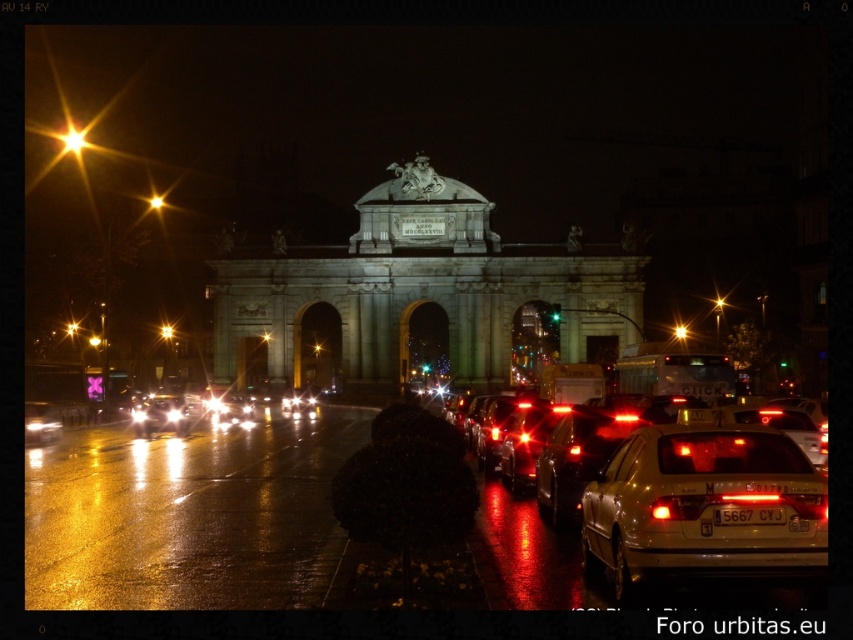
Can you confirm if metallic gold sedan at center-right is positioned below shiny silver car at lower left?

Correct, metallic gold sedan at center-right is located below shiny silver car at lower left.

Is metallic gold sedan at center-right positioned behind shiny silver car at lower left?

That is False.

Identify the location of metallic gold sedan at center-right. (717, 515).

Is metallic gold taxi at center bigger than bright metallic starburst at upper left?

Correct, metallic gold taxi at center is larger in size than bright metallic starburst at upper left.

What do you see at coordinates (704, 504) in the screenshot? Image resolution: width=853 pixels, height=640 pixels. I see `metallic gold taxi at center` at bounding box center [704, 504].

Which is in front, point (772, 445) or point (71, 129)?

Point (772, 445) is more forward.

Identify the location of metallic gold taxi at center. pyautogui.click(x=704, y=504).

Measure the distance between shiny silver car at lower left and camera.

shiny silver car at lower left is 163.28 meters away from camera.

Can you confirm if shiny silver car at lower left is positioned to the right of metallic starburst at center?

No, shiny silver car at lower left is not to the right of metallic starburst at center.

What are the coordinates of `shiny silver car at lower left` in the screenshot? It's located at (41, 422).